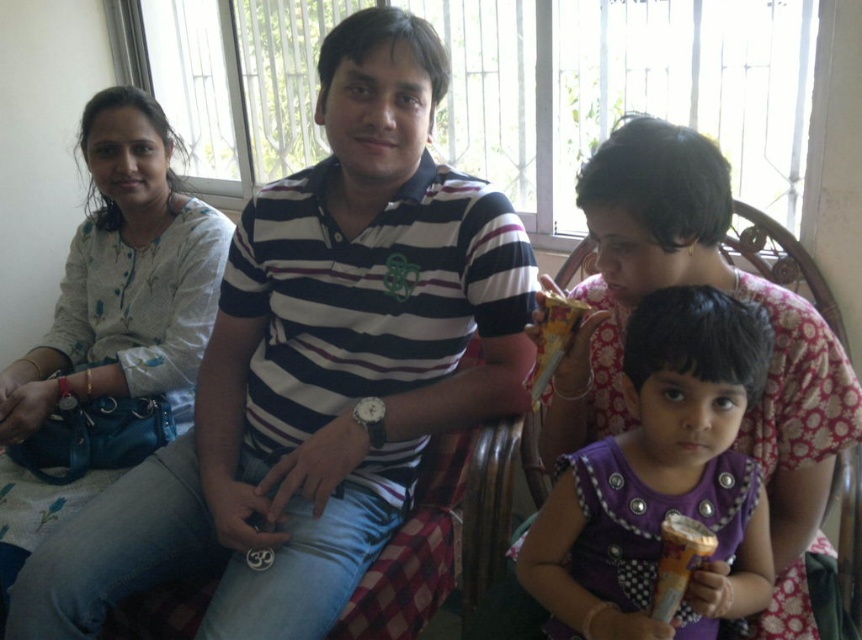
You are a photographer trying to capture a candid shot of the purple satin dress at center and the metallic gold ice cream cone at lower right. To ensure both subjects are in frame, you need to know their relative positions. Which object is positioned to the left of the other?

The metallic gold ice cream cone at lower right is to the left of the purple satin dress at center because the purple satin dress at center is positioned to the right of the metallic gold ice cream cone at lower right.